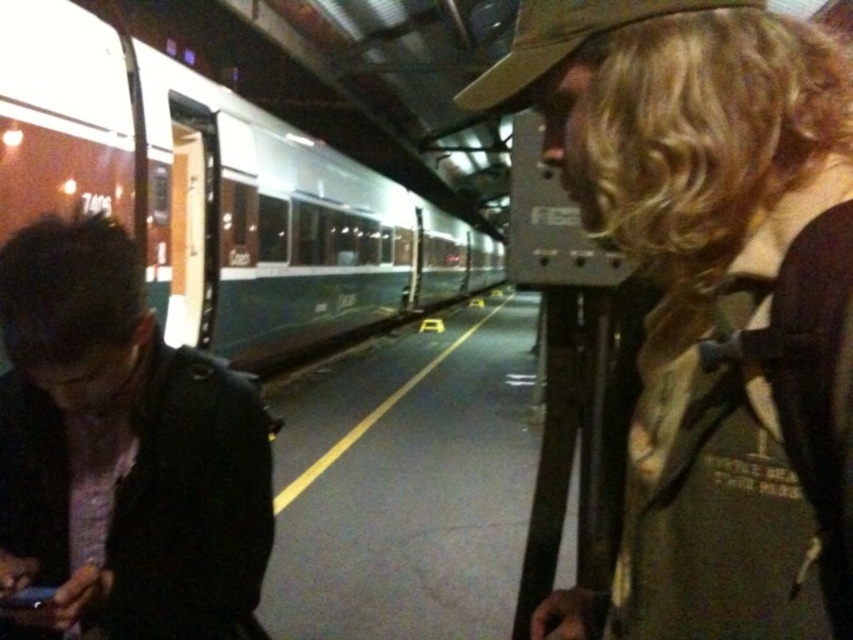
Question: Is camouflage backpack at center to the left of green matte train at left from the viewer's perspective?

Choices:
 (A) no
 (B) yes

Answer: (A)

Question: Is camouflage backpack at center positioned before green matte train at left?

Choices:
 (A) no
 (B) yes

Answer: (B)

Question: Among these objects, which one is nearest to the camera?

Choices:
 (A) green matte train at left
 (B) dark brown leather jacket at lower left

Answer: (B)

Question: Which object appears farthest from the camera in this image?

Choices:
 (A) camouflage backpack at center
 (B) green matte train at left
 (C) dark brown leather jacket at lower left

Answer: (B)

Question: Which of the following is the closest to the observer?

Choices:
 (A) (57, 67)
 (B) (668, 88)
 (C) (38, 435)

Answer: (B)

Question: Does green matte train at left appear over dark brown leather jacket at lower left?

Choices:
 (A) yes
 (B) no

Answer: (A)